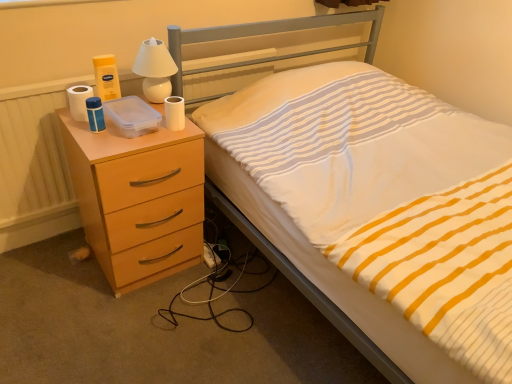
The height and width of the screenshot is (384, 512). Identify the location of vacant space in front of white matte toilet paper at upper right, the 1th toilet paper from the right. (154, 138).